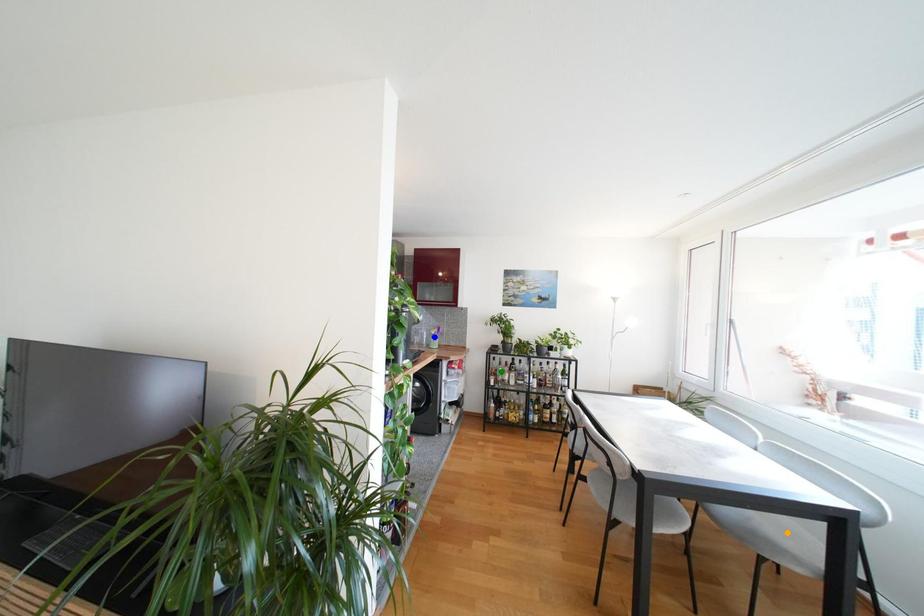
Order these from nearest to farthest:
blue point | orange point | green point

orange point → green point → blue point